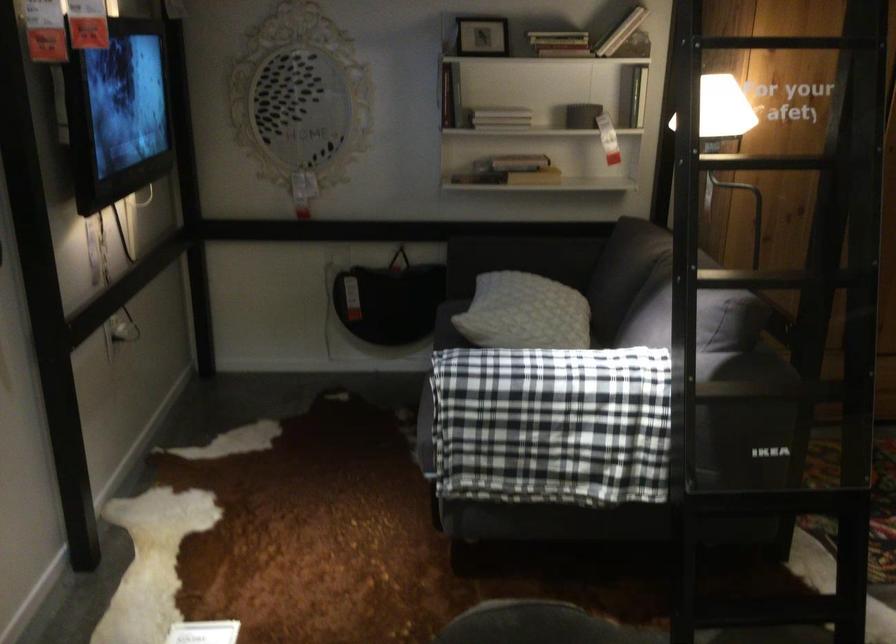
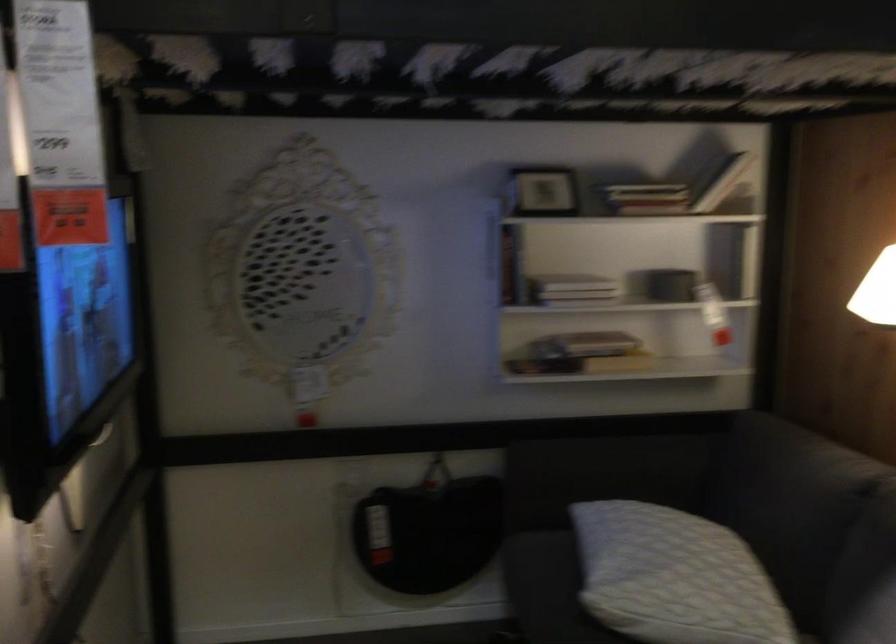
The images are taken continuously from a first-person perspective. In which direction are you moving?

The cameraman moved toward left, forward.